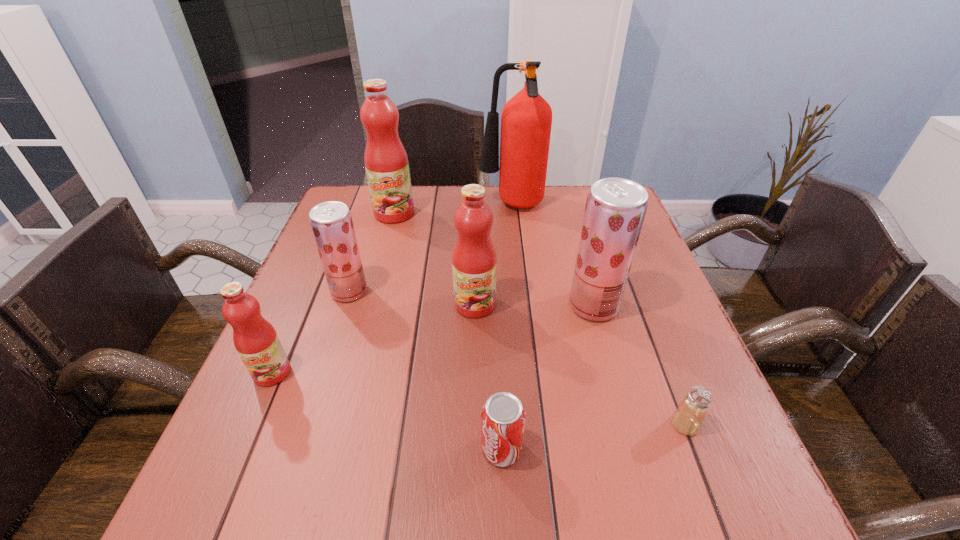
Where is `free space at the left edge of the desktop`? free space at the left edge of the desktop is located at coordinates (291, 446).

In the image, there is a desktop. Identify the location of free space at the right edge. The image size is (960, 540). (650, 381).

In the image, there is a desktop. What are the coordinates of `vacant region at the far left corner` in the screenshot? It's located at (357, 200).

Find the location of `free location at the near right corner`. free location at the near right corner is located at coordinates (762, 495).

Identify the location of unoccupied position between the smaller strawberry fruit juice and the nearest pink fruit juice. Image resolution: width=960 pixels, height=540 pixels. (311, 332).

Find the location of a particular element. The width and height of the screenshot is (960, 540). vacant area that lies between the soda can and the bigger strawberry fruit juice is located at coordinates (547, 377).

Image resolution: width=960 pixels, height=540 pixels. I want to click on free space between the bigger strawberry fruit juice and the leftmost pink fruit juice, so click(433, 339).

What are the coordinates of `vacant space that's between the rightmost pink fruit juice and the left strawberry fruit juice` in the screenshot? It's located at (412, 298).

Locate an element on the screen. Image resolution: width=960 pixels, height=540 pixels. free space between the second object from right to left and the leftmost object is located at coordinates (433, 339).

Where is `free space between the soda can and the smaller strawberry fruit juice`? Image resolution: width=960 pixels, height=540 pixels. free space between the soda can and the smaller strawberry fruit juice is located at coordinates (425, 370).